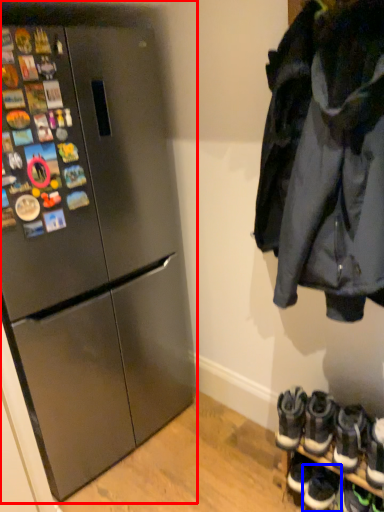
Question: Which object is further to the camera taking this photo, refrigerator (highlighted by a red box) or footwear (highlighted by a blue box)?

Choices:
 (A) refrigerator
 (B) footwear

Answer: (B)